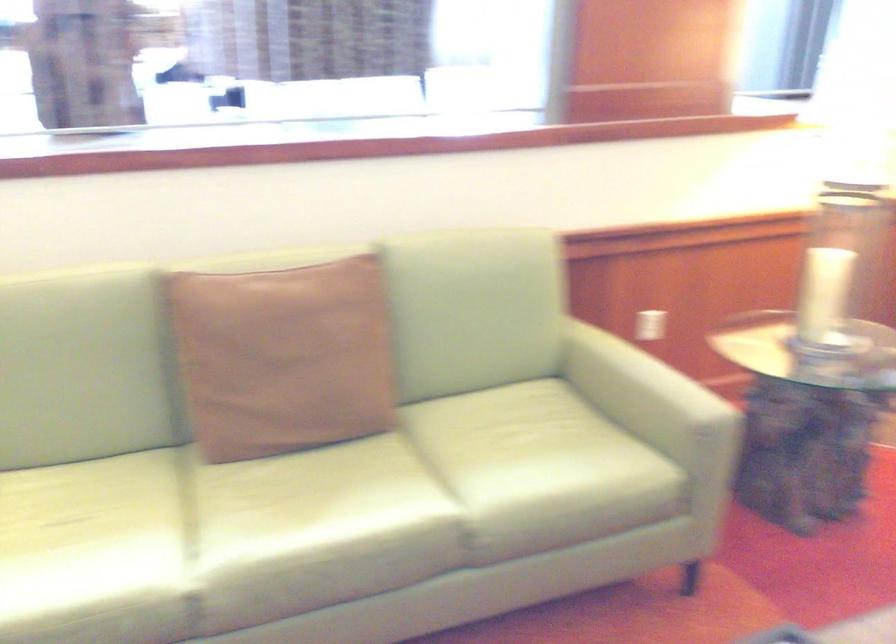
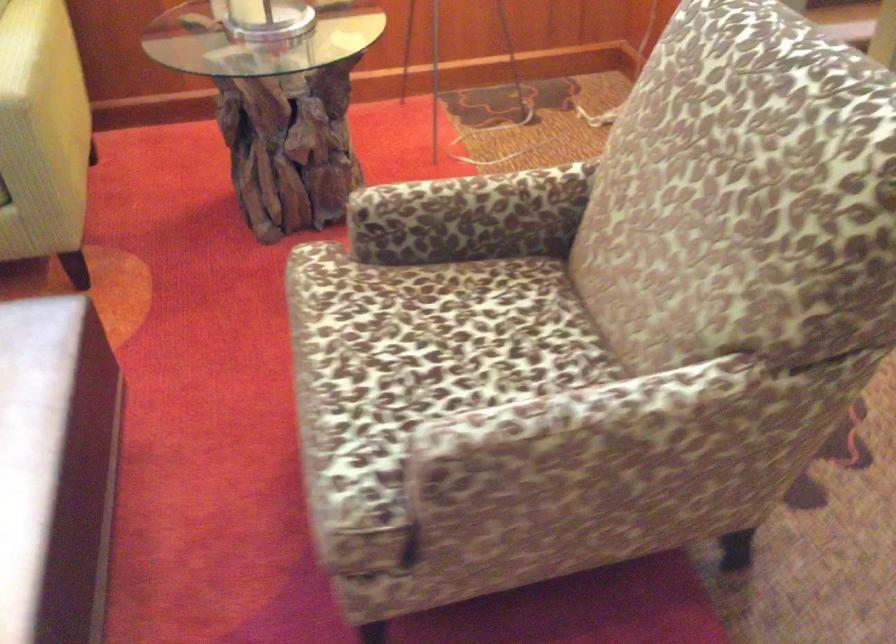
Question: The images are taken continuously from a first-person perspective. In which direction are you moving?

Choices:
 (A) Left
 (B) Right
 (C) Forward
 (D) Backward

Answer: (B)